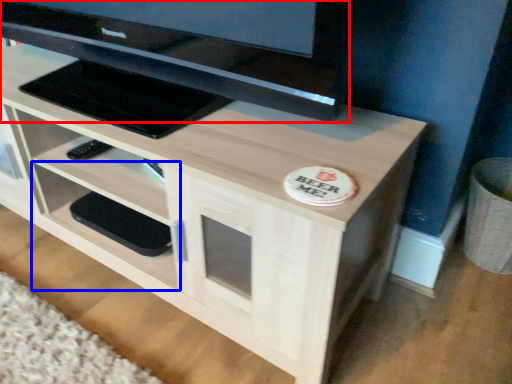
Question: Which of the following is the farthest to the observer, television (highlighted by a red box) or shelf (highlighted by a blue box)?

Choices:
 (A) television
 (B) shelf

Answer: (B)